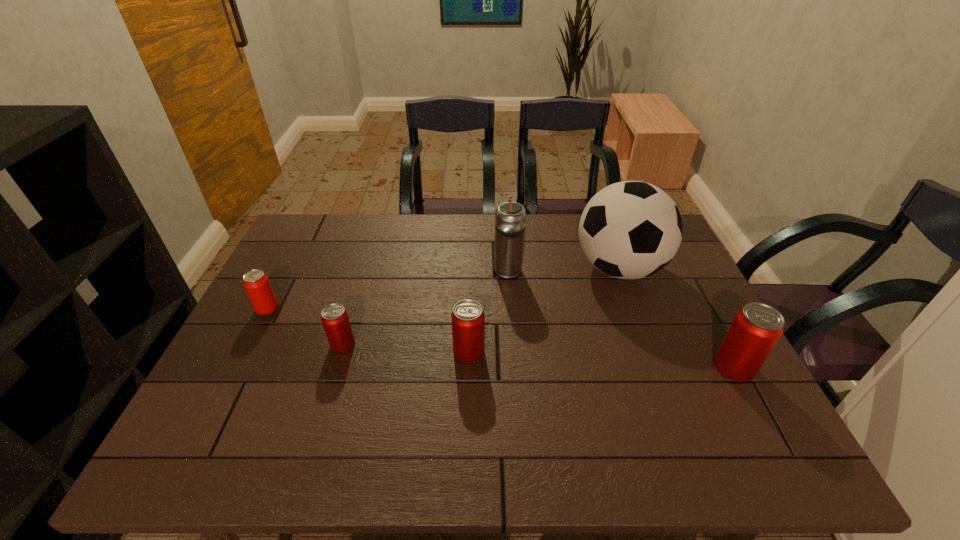
In order to click on object that is at the far edge in this screenshot , I will do `click(629, 230)`.

Locate an element on the screen. object situated at the left edge is located at coordinates (257, 285).

Where is `can that is at the right edge`? This screenshot has height=540, width=960. can that is at the right edge is located at coordinates (756, 329).

Locate an element on the screen. Image resolution: width=960 pixels, height=540 pixels. soccer ball that is positioned at the right edge is located at coordinates (629, 230).

You are a GUI agent. You are given a task and a screenshot of the screen. Output one action in this format:
    pyautogui.click(x=<x>, y=<y>)
    Task: Click on the object located at the far right corner
    
    Given the screenshot: What is the action you would take?
    pyautogui.click(x=629, y=230)

Identify the location of free space at the far edge of the desktop. (492, 225).

The width and height of the screenshot is (960, 540). I want to click on vacant region at the near edge of the desktop, so click(x=449, y=406).

The image size is (960, 540). Identify the location of blank space at the right edge of the desktop. (705, 362).

Image resolution: width=960 pixels, height=540 pixels. In order to click on free space at the far left corner of the desktop in this screenshot , I will do `click(300, 234)`.

You are a GUI agent. You are given a task and a screenshot of the screen. Output one action in this format:
    pyautogui.click(x=<x>, y=<y>)
    Task: Click on the vacant space that's between the tallest can and the soccer ball
    
    Given the screenshot: What is the action you would take?
    pyautogui.click(x=677, y=318)